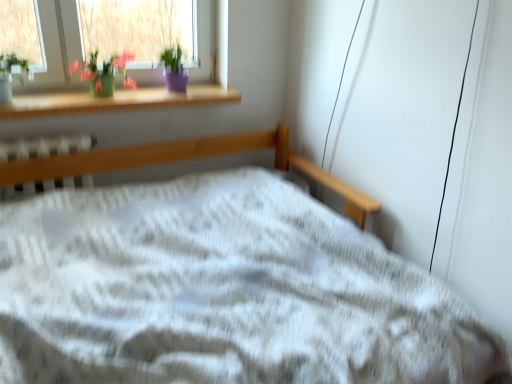
Question: Is green matte vase at upper left turned away from white plastic radiator at center?

Choices:
 (A) no
 (B) yes

Answer: (A)

Question: From the image's perspective, is green matte vase at upper left under white plastic radiator at center?

Choices:
 (A) yes
 (B) no

Answer: (B)

Question: Is green matte vase at upper left facing towards white plastic radiator at center?

Choices:
 (A) no
 (B) yes

Answer: (A)

Question: Can you confirm if green matte vase at upper left is wider than white plastic radiator at center?

Choices:
 (A) yes
 (B) no

Answer: (A)

Question: From a real-world perspective, is green matte vase at upper left below white plastic radiator at center?

Choices:
 (A) no
 (B) yes

Answer: (A)

Question: Is green matte vase at upper left further to camera compared to white plastic radiator at center?

Choices:
 (A) yes
 (B) no

Answer: (A)

Question: From the image's perspective, would you say wooden at upper left is positioned over white plastic radiator at center?

Choices:
 (A) yes
 (B) no

Answer: (A)

Question: From a real-world perspective, does wooden at upper left sit lower than white plastic radiator at center?

Choices:
 (A) yes
 (B) no

Answer: (B)

Question: Is wooden at upper left behind white plastic radiator at center?

Choices:
 (A) yes
 (B) no

Answer: (A)

Question: Is wooden at upper left placed right next to white plastic radiator at center?

Choices:
 (A) yes
 (B) no

Answer: (B)

Question: Is wooden at upper left positioned far away from white plastic radiator at center?

Choices:
 (A) no
 (B) yes

Answer: (A)

Question: From the image's perspective, is wooden at upper left located beneath white plastic radiator at center?

Choices:
 (A) yes
 (B) no

Answer: (B)

Question: Is there a large distance between white plastic radiator at center and green matte vase at upper left?

Choices:
 (A) no
 (B) yes

Answer: (A)